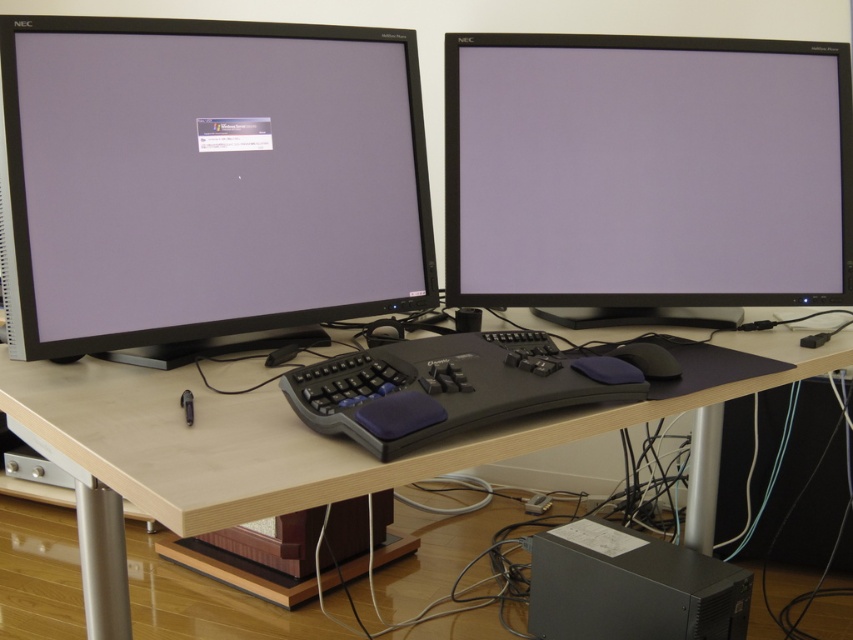
You are standing in front of the workspace shown in the image. The light wood table at center is part of your desk setup. If you want to place a 24 inch laptop on the desk, will there be enough space between you and the table to safely place it?

The light wood table at center and viewer are 26.42 inches apart from each other. Since the laptop is 24 inches wide, there is sufficient space between you and the table to safely place it as 26.42 inches is greater than 24 inches.

What object is located at the coordinates point (207,179)?

The point (207,179) corresponds to the matte black monitor at left.

You are standing in front of the workspace setup. There is a point marked at coordinates (216, 68) on the desk. If you want to place a 1.2 meter long ruler from your current position to that point, will it fit entirely on the desk?

The distance between you and the point is 1.16 meters, so the 1.2 meter ruler will not fit entirely on the desk as it is slightly longer than the available space.